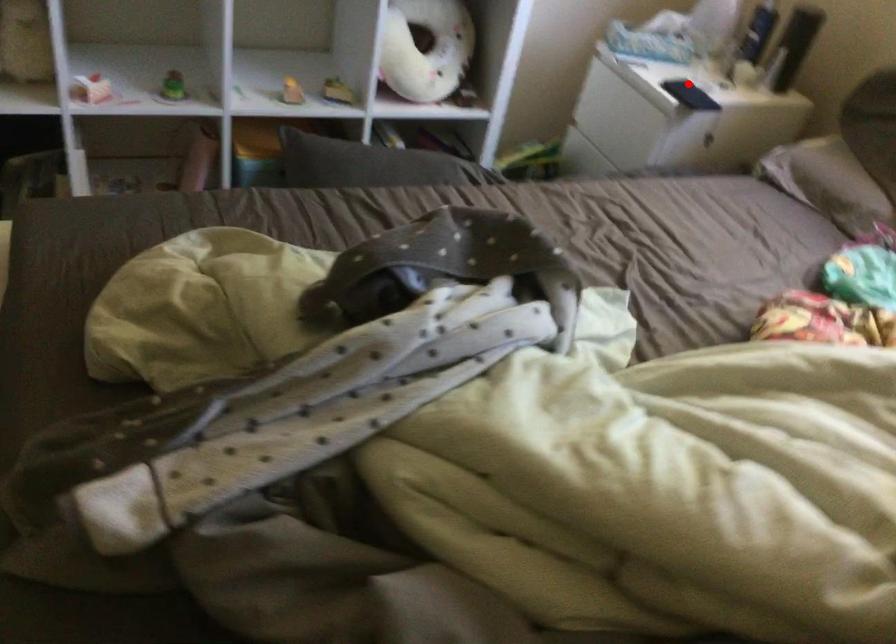
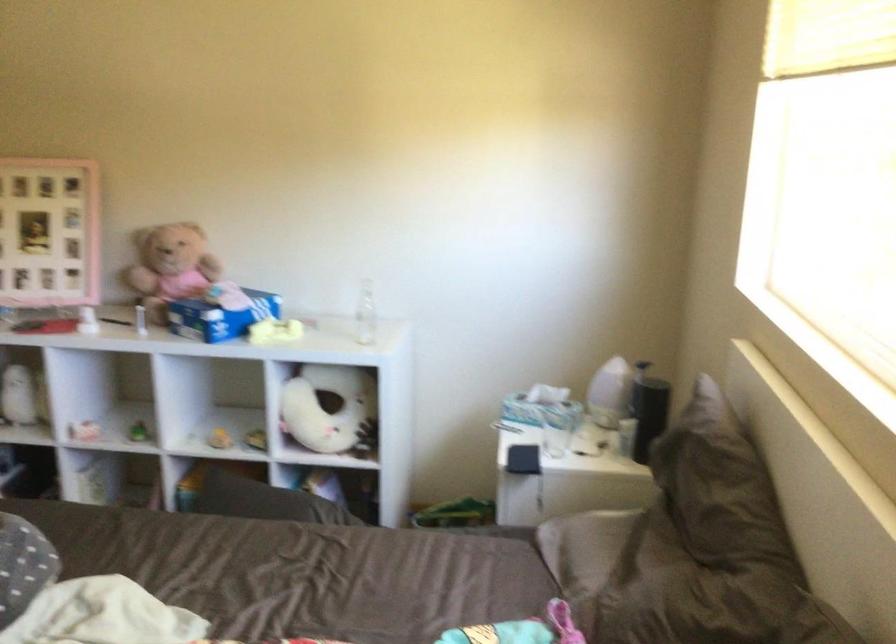
Locate, in the second image, the point that corresponds to the highlighted location in the first image.

(522, 459)